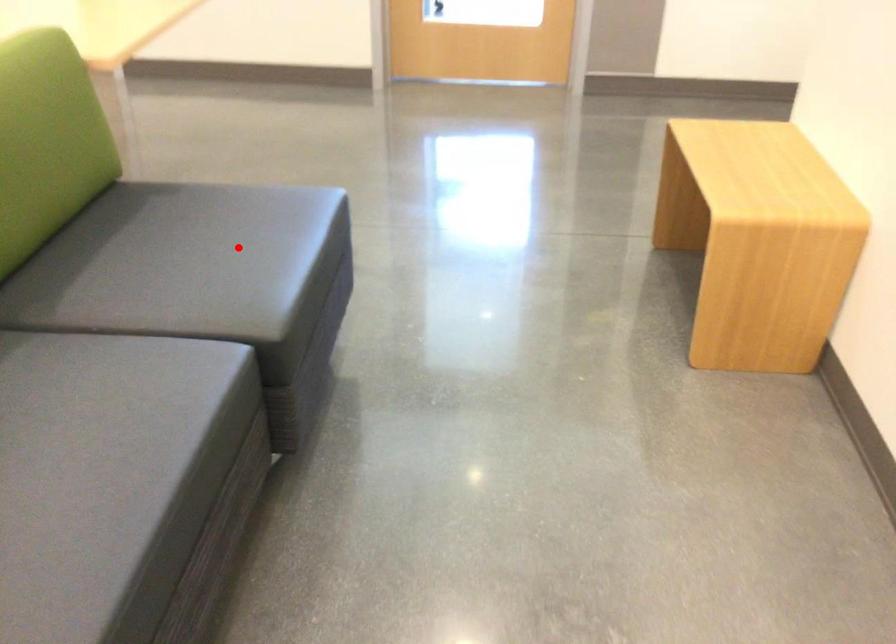
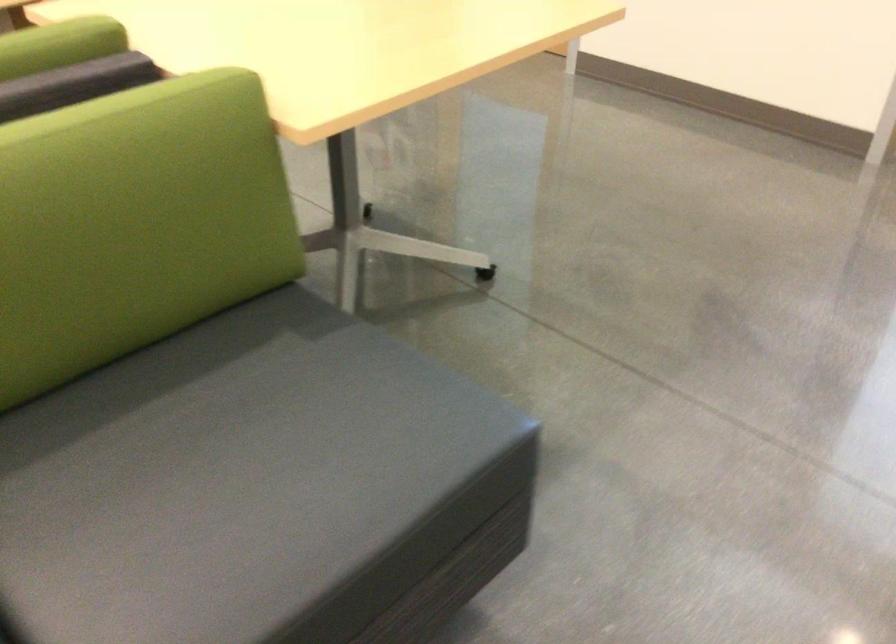
Question: A red point is marked in image1. In image2, is the corresponding 3D point closer to the camera or farther? Reply with the corresponding letter.

Choices:
 (A) The corresponding 3D point is closer.
 (B) The corresponding 3D point is farther.

Answer: (A)